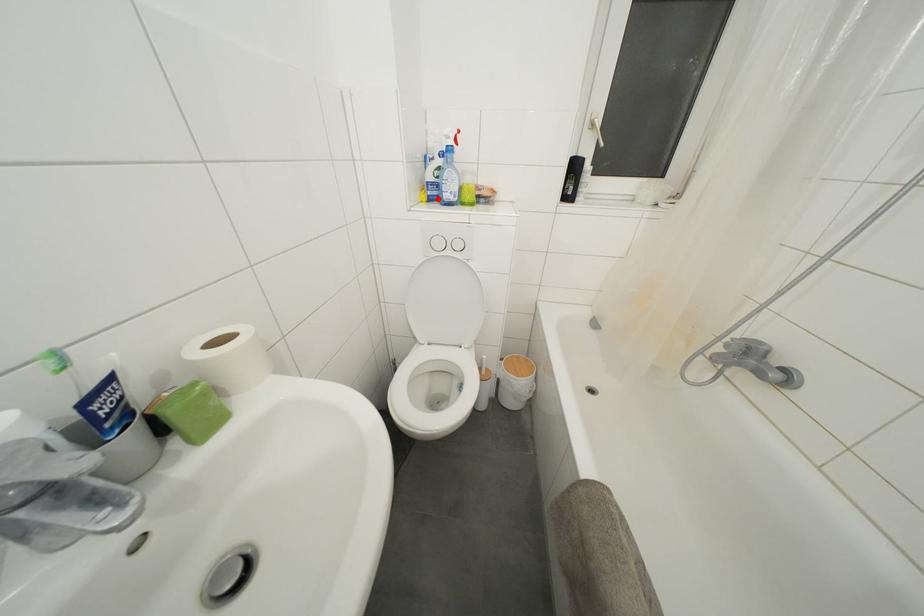
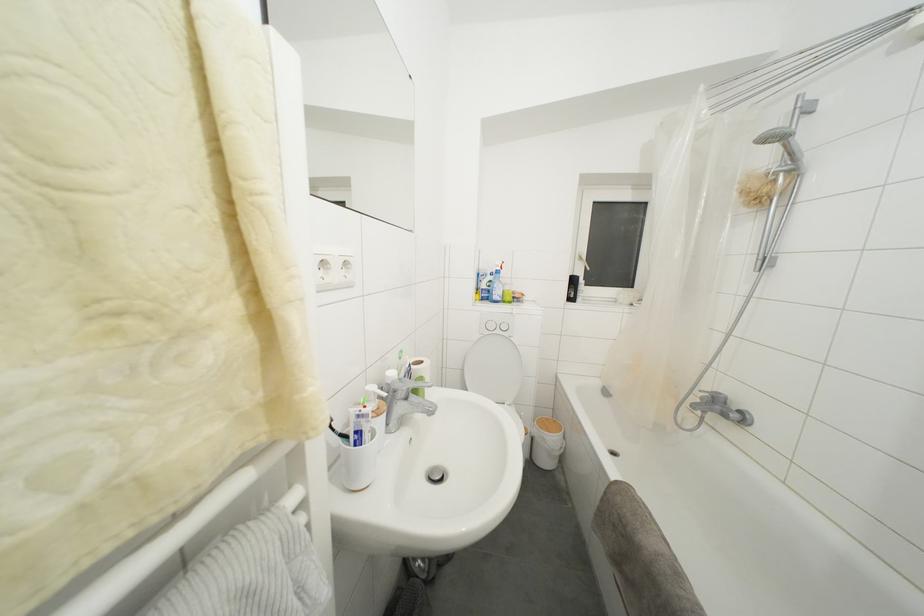
Find the pixel in the second image that matches the highlighted location in the first image.

(490, 301)